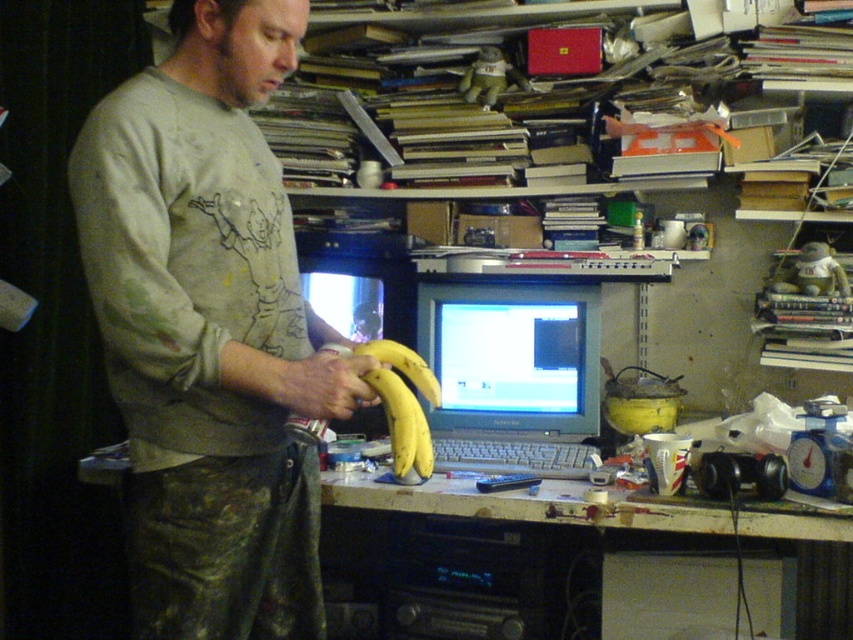
You are a delivery person who needs to place a package on the desk without moving any items. The package is 4 feet long. Can you fit it on the desk between the light gray sweatshirt at center and the edge of the desk?

The light gray sweatshirt at center is 3.81 feet away from the camera. Since the package is 4 feet long, it might not fit if the distance from the sweatshirt to the edge is less than 4 feet. However, the description only provides the distance from the sweatshirt to the camera, not the desk edge. More information is needed to determine if there is enough space.

You are a delivery person who needs to place a small package between the light gray sweatshirt at center and the matte gray monitor at center. The package is 70 centimeters long. Will the package fit in the space between them?

The distance between the light gray sweatshirt at center and the matte gray monitor at center is 69.60 centimeters. Since the package is 70 centimeters long, it is slightly longer than the available space. Therefore, the package will not fit between them.